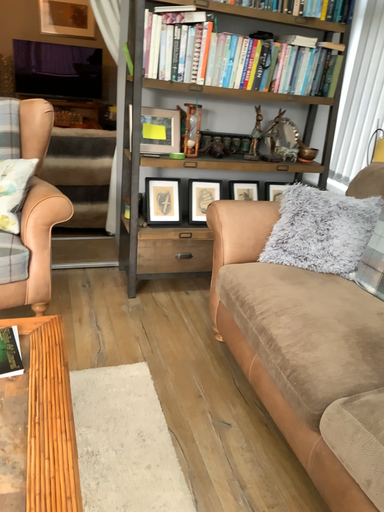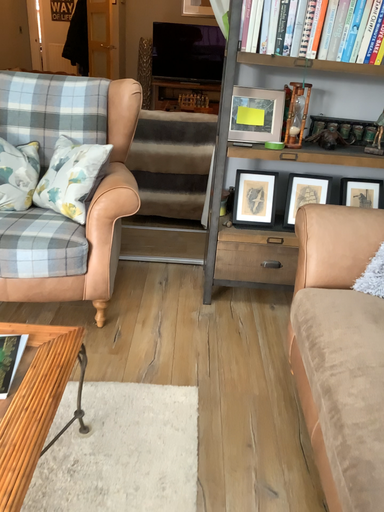
Question: Which way did the camera rotate in the video?

Choices:
 (A) rotated right
 (B) rotated left

Answer: (B)